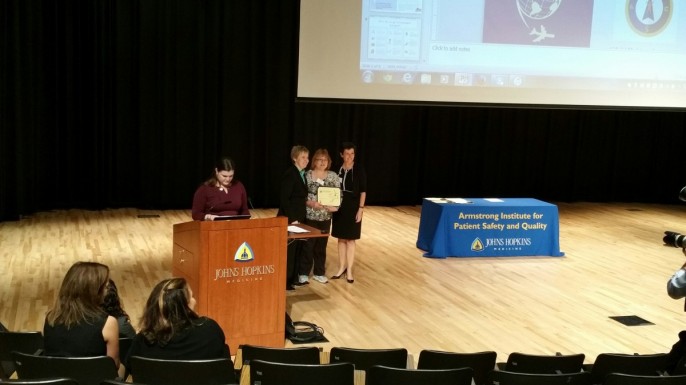
Image resolution: width=686 pixels, height=385 pixels. What are the coordinates of `wooden podium` in the screenshot? It's located at (256, 305).